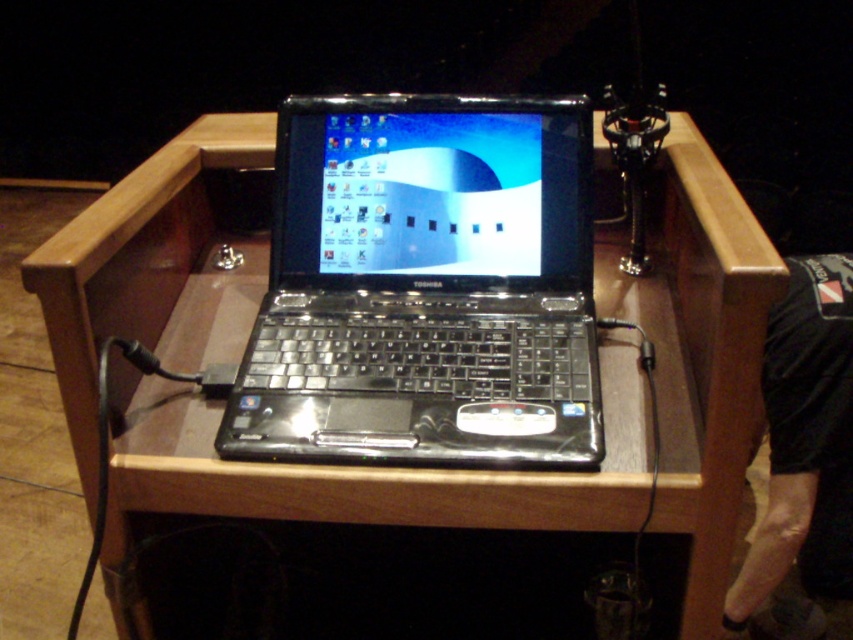
You are setting up a presentation and need to place a microphone stand to the right of the black glossy laptop at center. According to the image, is there enough space on the podium to position the microphone stand to the right of the laptop without it going off the frame?

The black glossy laptop at center is located at point (x=425, y=288). Since the microphone stand is to the right of the laptop and the USB cable extends off the right side of the frame, there might not be sufficient space to place the microphone stand without it going off the frame. However, the exact spatial relationship isn not explicitly stated in the provided descriptions. Please check the actual setup for confirmation.

You are organizing a presentation and need to place a name tag on the podium. The name tag is small enough to fit on either the black glossy laptop at center or the black fabric at lower right. Which surface would allow the name tag to be placed without overlapping any other objects?

The black fabric at lower right has more space since it occupies more area than the black glossy laptop at center, so placing the name tag there would avoid overlapping other objects.

You are organizing a presentation and need to place a name tag on the podium. The name tag is 10 cm wide. You see the black glossy laptop at center and the black fabric at lower right. Which object has enough space to place the name tag next to it without overlapping?

The black glossy laptop at center has a width that surpasses the black fabric at lower right, so placing the name tag next to the black glossy laptop at center would provide sufficient space since it is wider than the black fabric at lower right.